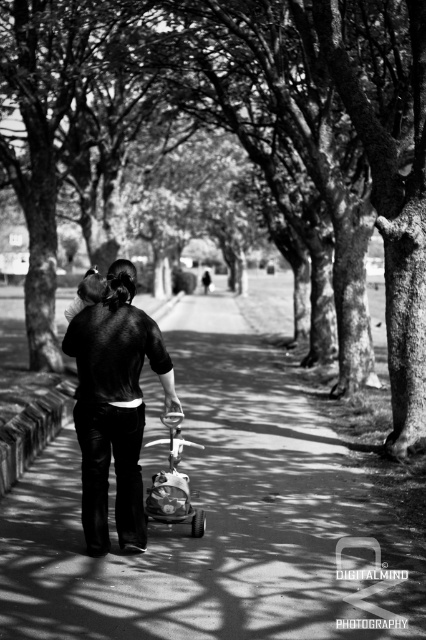
Can you confirm if smooth bark tree at center is shorter than matte plastic baby carriage at center?

No.

Is point (14, 54) behind point (169, 464)?

Yes, point (14, 54) is behind point (169, 464).

Image resolution: width=426 pixels, height=640 pixels. I want to click on smooth bark tree at center, so click(386, 180).

Which of these two, smooth bark tree at center or dark matte jacket at center, stands taller?

With more height is smooth bark tree at center.

Between smooth bark tree at center and dark matte jacket at center, which one appears on the left side from the viewer's perspective?

From the viewer's perspective, smooth bark tree at center appears more on the left side.

Between point (229, 0) and point (141, 518), which one is positioned in front?

Point (141, 518)

This screenshot has height=640, width=426. I want to click on smooth bark tree at center, so click(386, 180).

From the picture: Is smooth concrete pavement at center wider than matte plastic baby carriage at center?

Yes, smooth concrete pavement at center is wider than matte plastic baby carriage at center.

How far apart are smooth concrete pavement at center and matte plastic baby carriage at center?

A distance of 19.80 feet exists between smooth concrete pavement at center and matte plastic baby carriage at center.

Where is `smooth concrete pavement at center`? smooth concrete pavement at center is located at coordinates (218, 518).